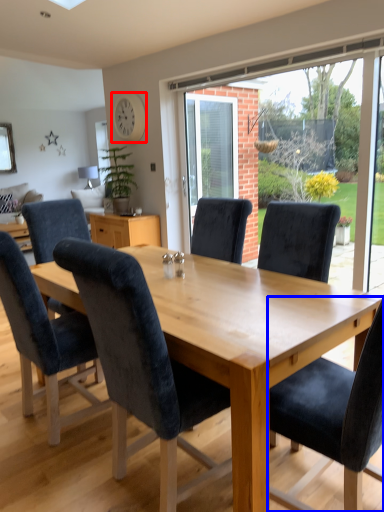
Question: Which object appears farthest to the camera in this image, clock (highlighted by a red box) or chair (highlighted by a blue box)?

Choices:
 (A) clock
 (B) chair

Answer: (A)